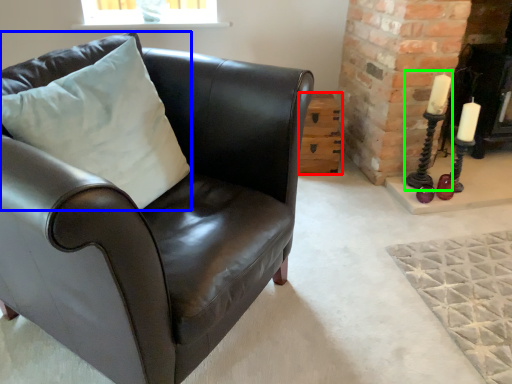
Question: Which object is positioned farthest from table (highlighted by a red box)? Select from pillow (highlighted by a blue box) and candle holder (highlighted by a green box).

Choices:
 (A) pillow
 (B) candle holder

Answer: (A)